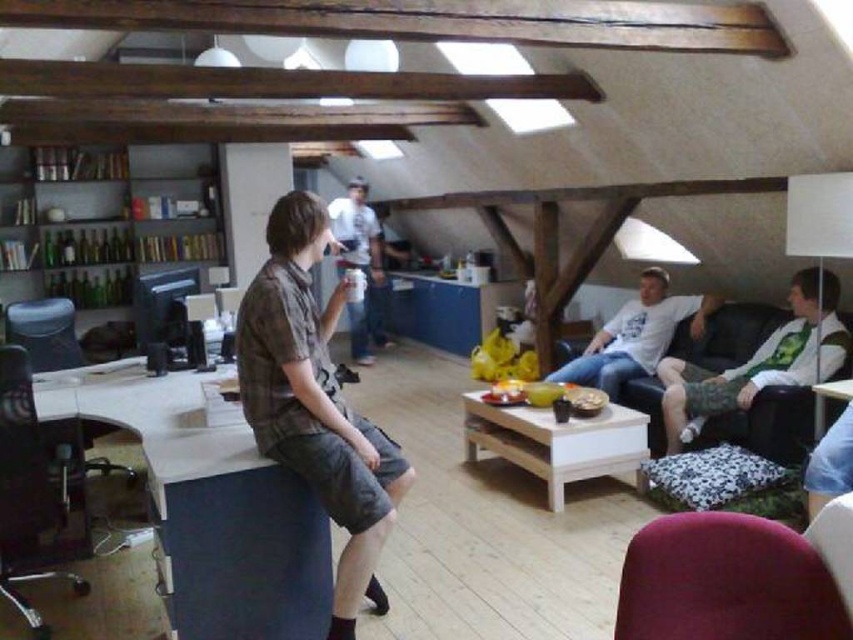
Can you confirm if black leather armchair at left is positioned to the right of camouflage shorts at right?

No, black leather armchair at left is not to the right of camouflage shorts at right.

Is point (70, 497) more distant than point (828, 308)?

No.

The width and height of the screenshot is (853, 640). In order to click on black leather armchair at left in this screenshot , I will do `click(35, 492)`.

Which of these two, plaid cotton shirt at center or white cotton shirt at center, stands taller?

white cotton shirt at center

Is point (300, 452) closer to camera compared to point (343, 209)?

Yes, point (300, 452) is in front of point (343, 209).

At what (x,y) coordinates should I click in order to perform the action: click on plaid cotton shirt at center. Please return your answer as a coordinate pair (x, y). The height and width of the screenshot is (640, 853). Looking at the image, I should click on (314, 397).

Can you confirm if velvet maroon armchair at lower right is thinner than white cotton shirt at center?

Yes.

Looking at this image, can you confirm if velvet maroon armchair at lower right is bigger than white cotton shirt at center?

No, velvet maroon armchair at lower right is not bigger than white cotton shirt at center.

This screenshot has height=640, width=853. What do you see at coordinates (726, 580) in the screenshot?
I see `velvet maroon armchair at lower right` at bounding box center [726, 580].

You are a GUI agent. You are given a task and a screenshot of the screen. Output one action in this format:
    pyautogui.click(x=<x>, y=<y>)
    Task: Click on the velvet maroon armchair at lower right
    Image resolution: width=853 pixels, height=640 pixels.
    Given the screenshot: What is the action you would take?
    pyautogui.click(x=726, y=580)